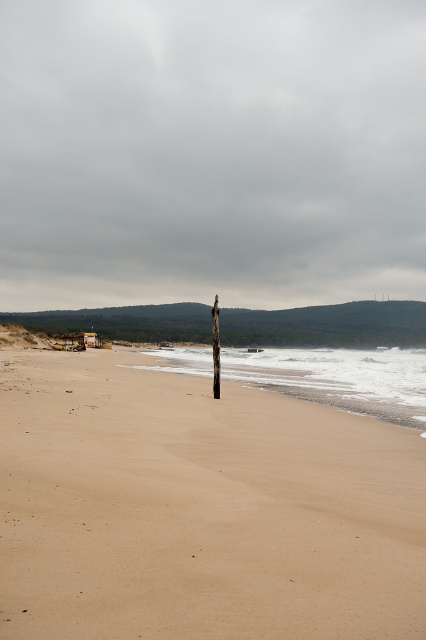
Consider the image. Can you confirm if sandy at center is taller than smooth sand shoreline at center?

In fact, sandy at center may be shorter than smooth sand shoreline at center.

Does sandy at center have a lesser height compared to smooth sand shoreline at center?

Yes, sandy at center is shorter than smooth sand shoreline at center.

Between point (412, 612) and point (400, 355), which one is positioned behind?

The point (400, 355) is more distant.

Locate an element on the screen. sandy at center is located at coordinates (199, 509).

Is sandy at center above brown wooden telegraph pole at center?

Incorrect, sandy at center is not positioned above brown wooden telegraph pole at center.

Does sandy at center appear on the right side of brown wooden telegraph pole at center?

No, sandy at center is not to the right of brown wooden telegraph pole at center.

Locate an element on the screen. sandy at center is located at coordinates (199, 509).

The width and height of the screenshot is (426, 640). Describe the element at coordinates (339, 378) in the screenshot. I see `smooth sand shoreline at center` at that location.

Is smooth sand shoreline at center further to camera compared to brown wooden telegraph pole at center?

No.

Which is in front, point (183, 364) or point (219, 364)?

Point (219, 364) is in front.

Find the location of `smooth sand shoreline at center`. smooth sand shoreline at center is located at coordinates (x=339, y=378).